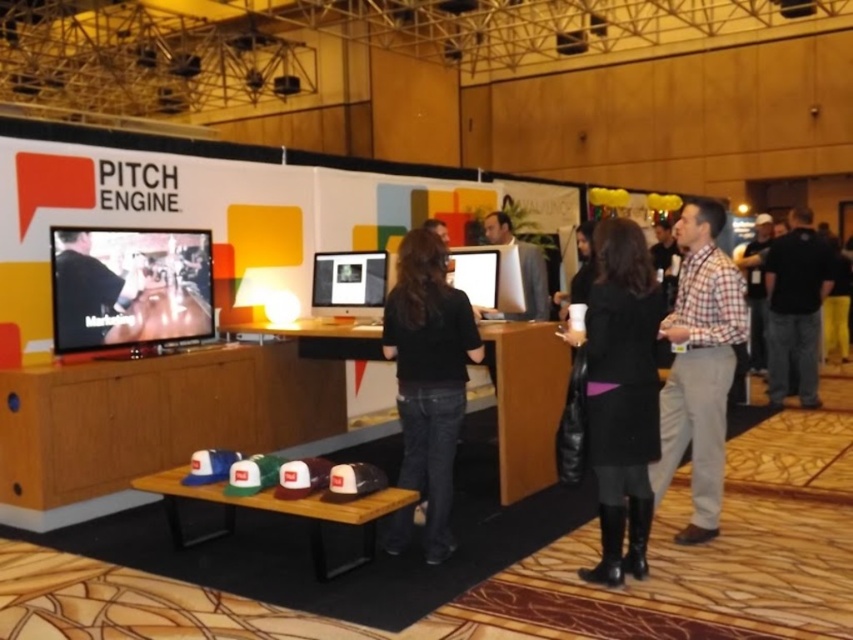
You are a photographer setting up a shoot in the booth. You need to place a 1.2 meter tall tripod between the plaid cotton shirt at right and the matte black monitor at center. Will the tripod fit vertically between them without touching either object?

The plaid cotton shirt at right is taller than the matte black monitor at center. Since the tripod is 1.2 meters tall, it may not fit vertically between them as the height difference between the two objects might not accommodate the tripod without touching either.